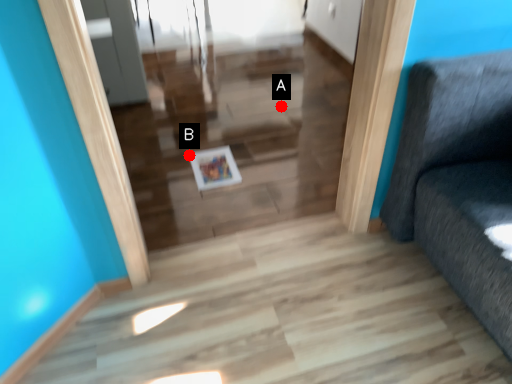
Question: Two points are circled on the image, labeled by A and B beside each circle. Which point is closer to the camera?

Choices:
 (A) A is closer
 (B) B is closer

Answer: (B)